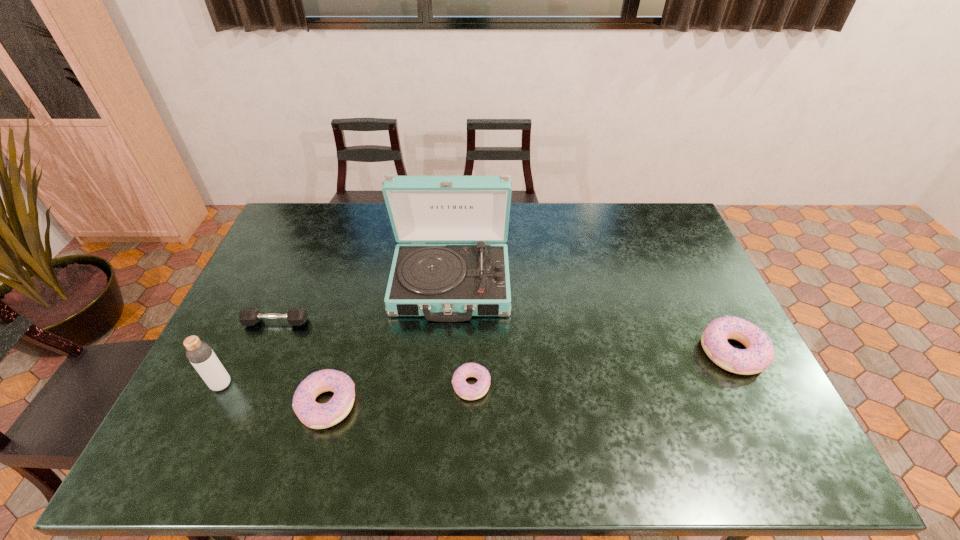
Where is `vacant region located 0.100m on the back of the rightmost doughnut`? This screenshot has width=960, height=540. vacant region located 0.100m on the back of the rightmost doughnut is located at coordinates (707, 302).

Locate an element on the screen. This screenshot has height=540, width=960. free spot located 0.100m on the front of the dumbbell is located at coordinates (261, 357).

This screenshot has width=960, height=540. I want to click on vacant space situated 0.110m on the right of the fifth shortest object, so click(x=274, y=384).

Identify the location of vacant space located on the face side of the tallest object. (444, 380).

Find the location of a particular element. The height and width of the screenshot is (540, 960). bottle that is positioned at the near edge is located at coordinates (199, 353).

The image size is (960, 540). In order to click on dumbbell that is at the left edge in this screenshot , I will do point(249,316).

Identify the location of bottle situated at the left edge. This screenshot has height=540, width=960. click(199, 353).

You are a GUI agent. You are given a task and a screenshot of the screen. Output one action in this format:
    pyautogui.click(x=<x>, y=<y>)
    Task: Click on the object present at the right edge
    
    Given the screenshot: What is the action you would take?
    pyautogui.click(x=760, y=353)

Image resolution: width=960 pixels, height=540 pixels. What are the coordinates of `object situated at the near left corner` in the screenshot? It's located at pyautogui.click(x=199, y=353).

Image resolution: width=960 pixels, height=540 pixels. I want to click on free location at the far edge, so click(378, 230).